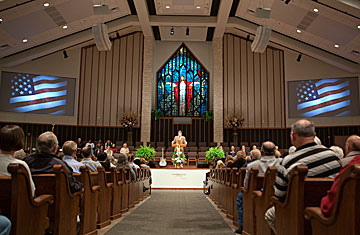
Locate an element on the screen. The width and height of the screenshot is (360, 235). tv monitor is located at coordinates (72, 98), (291, 94).